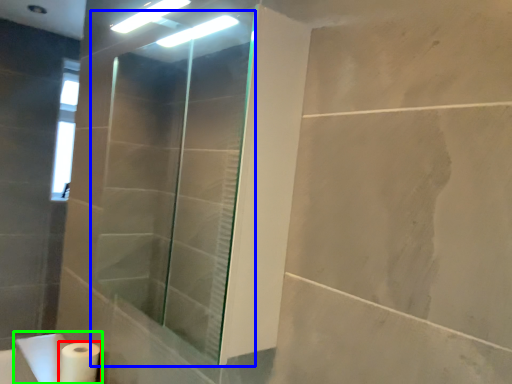
Question: Estimate the real-world distances between objects in this image. Which object is closer to toilet paper (highlighted by a red box), shower door (highlighted by a blue box) or sink (highlighted by a green box)?

Choices:
 (A) shower door
 (B) sink

Answer: (B)